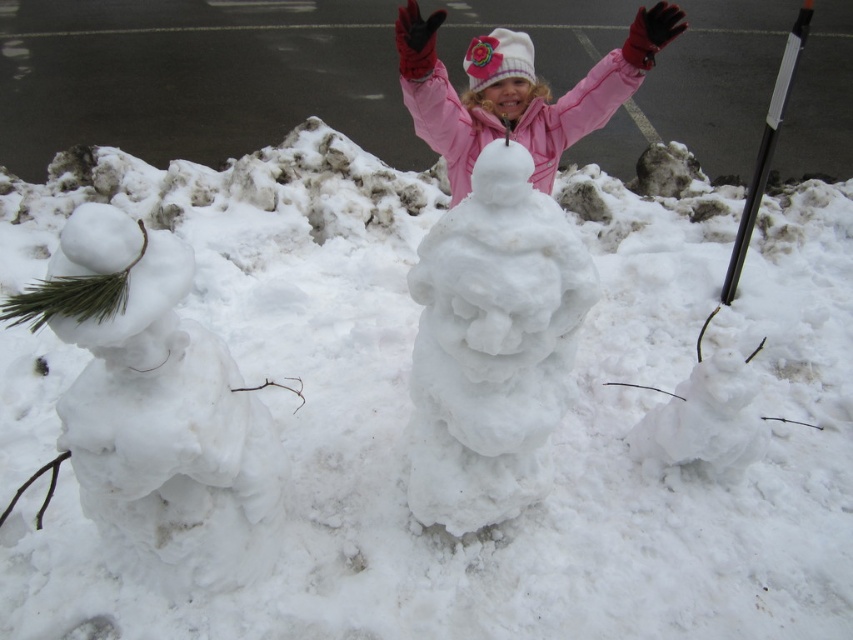
You are a photographer trying to capture the white fluffy snowman at center and the pink fleece jacket at center in the same frame. Based on their positions, which one should you focus on first to ensure both are in focus?

The white fluffy snowman at center is below the pink fleece jacket at center, so you should focus on the pink fleece jacket at center first to ensure both are in focus.

You are a photographer trying to capture the white fluffy snowman at center and the pink fleece jacket at center in a single shot. Which object should you focus on first to ensure both are in focus?

You should focus on the white fluffy snowman at center first because it is closer to the viewer than the pink fleece jacket at center, so focusing on it will ensure the pink fleece jacket at center also comes into focus.

You are the parent of the child in the image. You want to take a photo of your child and the snowmen from a distance where both the white fluffy snowman at left and the pink fleece jacket at center are visible. Which object will appear larger in the photo?

The white fluffy snowman at left will appear larger in the photo because it is much taller than the pink fleece jacket at center.